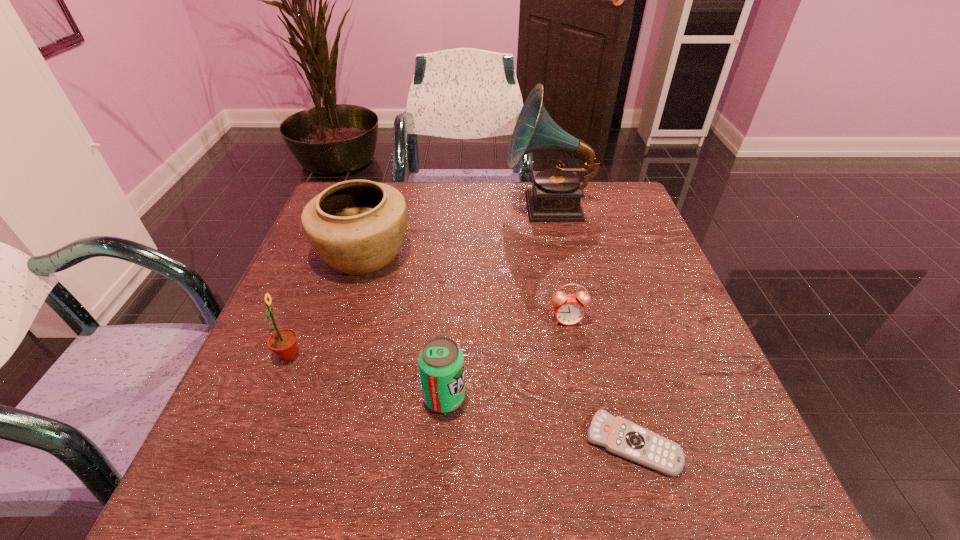
Locate an element on the screen. Image resolution: width=960 pixels, height=540 pixels. the tallest object is located at coordinates (556, 193).

Where is `pottery`? Image resolution: width=960 pixels, height=540 pixels. pottery is located at coordinates (357, 226).

Locate an element on the screen. the third nearest object is located at coordinates (283, 343).

Locate an element on the screen. the third shortest object is located at coordinates (441, 361).

I want to click on the fourth object from right to left, so click(441, 361).

The height and width of the screenshot is (540, 960). Identify the location of alarm clock. (569, 309).

You are a GUI agent. You are given a task and a screenshot of the screen. Output one action in this format:
    pyautogui.click(x=<x>, y=<y>)
    Task: Click on the fourth nearest object
    
    Given the screenshot: What is the action you would take?
    pyautogui.click(x=569, y=309)

I want to click on the shortest object, so click(x=619, y=436).

You are a GUI agent. You are given a task and a screenshot of the screen. Output one action in this format:
    pyautogui.click(x=<x>, y=<y>)
    Task: Click on the vacant space located from the horn of the phonograph_record
    The height and width of the screenshot is (540, 960).
    Given the screenshot: What is the action you would take?
    pyautogui.click(x=405, y=207)

This screenshot has height=540, width=960. I want to click on free space located 0.360m from the horn of the phonograph_record, so click(x=381, y=207).